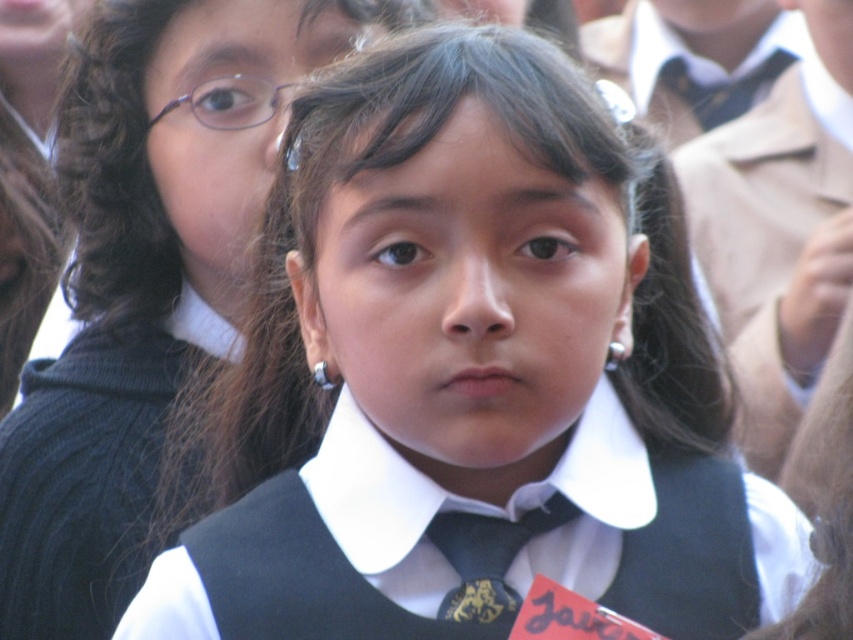
Question: Is matte black tie at upper right positioned at the back of purple plastic glasses at upper left?

Choices:
 (A) no
 (B) yes

Answer: (B)

Question: Is dark blue textured tie at center to the right of matte black tie at upper right from the viewer's perspective?

Choices:
 (A) yes
 (B) no

Answer: (B)

Question: Which object is positioned closest to the purple plastic glasses at upper left?

Choices:
 (A) dark blue textured tie at center
 (B) matte black vest at center
 (C) matte black tie at upper right

Answer: (B)

Question: Estimate the real-world distances between objects in this image. Which object is farther from the matte black vest at center?

Choices:
 (A) dark blue textured tie at center
 (B) purple plastic glasses at upper left
 (C) matte black tie at upper right

Answer: (C)

Question: Which of the following is the farthest from the observer?

Choices:
 (A) matte black tie at upper right
 (B) purple plastic glasses at upper left

Answer: (A)

Question: Does matte black vest at center appear on the left side of matte black tie at upper right?

Choices:
 (A) no
 (B) yes

Answer: (B)